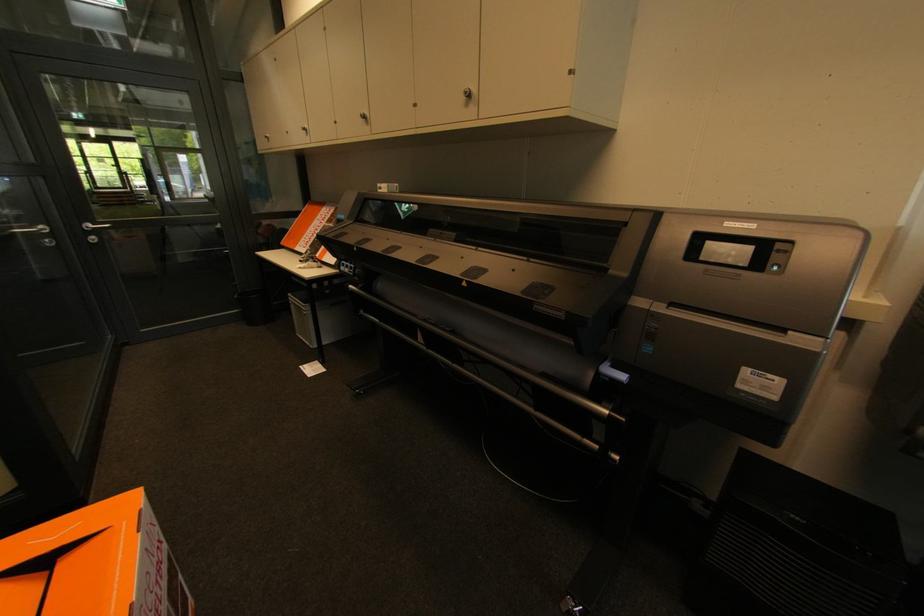
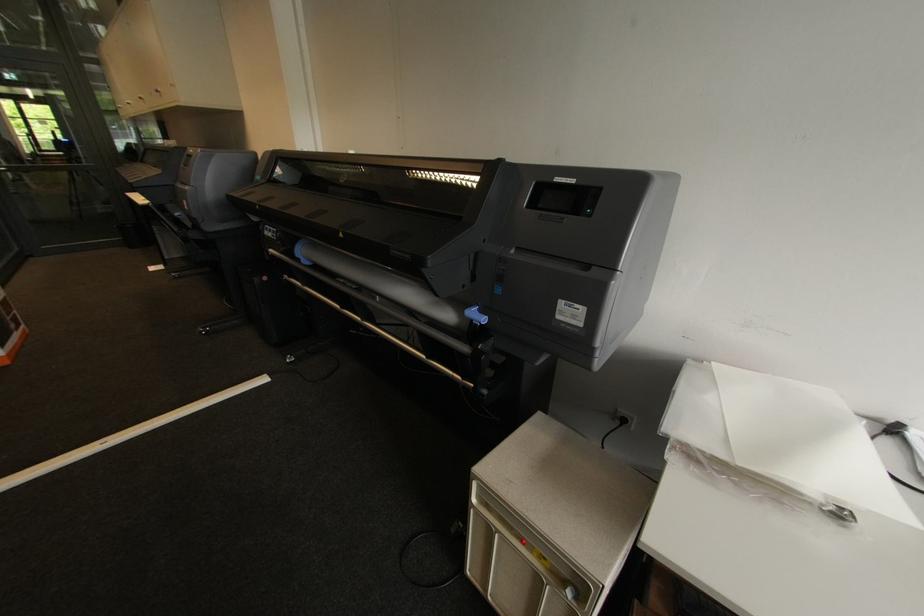
Which direction would the cameraman need to move to produce the second image?

The cameraman moved toward right, backward.